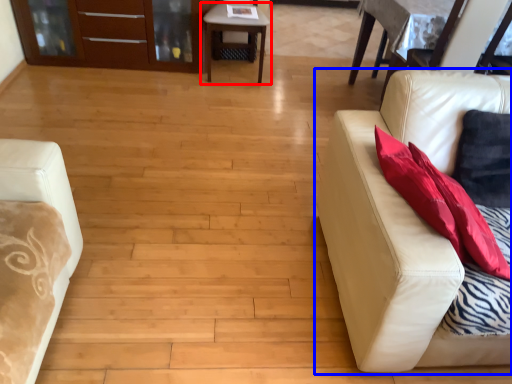
Question: Which of the following is the closest to the observer, table (highlighted by a red box) or studio couch (highlighted by a blue box)?

Choices:
 (A) table
 (B) studio couch

Answer: (B)